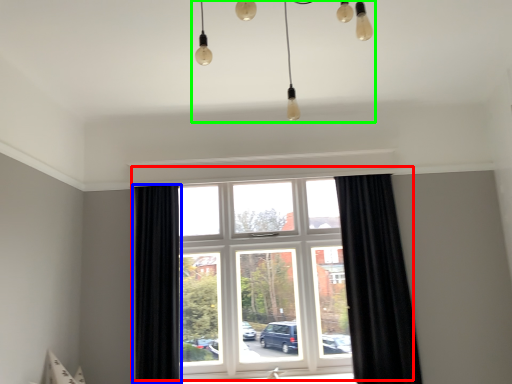
Question: Which is nearer to the window (highlighted by a red box)? curtain (highlighted by a blue box) or light fixture (highlighted by a green box).

Choices:
 (A) curtain
 (B) light fixture

Answer: (A)